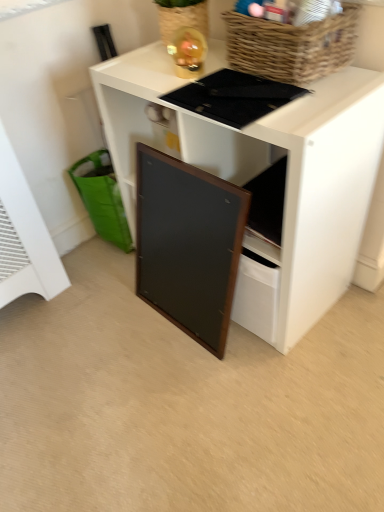
Question: Is woven brown basket at upper right wider than green fabric shopping basket at lower left?

Choices:
 (A) no
 (B) yes

Answer: (A)

Question: Is woven brown basket at upper right directly adjacent to green fabric shopping basket at lower left?

Choices:
 (A) no
 (B) yes

Answer: (A)

Question: Is woven brown basket at upper right smaller than green fabric shopping basket at lower left?

Choices:
 (A) no
 (B) yes

Answer: (B)

Question: From a real-world perspective, is woven brown basket at upper right positioned over green fabric shopping basket at lower left based on gravity?

Choices:
 (A) no
 (B) yes

Answer: (B)

Question: Could you tell me if woven brown basket at upper right is turned towards green fabric shopping basket at lower left?

Choices:
 (A) no
 (B) yes

Answer: (A)

Question: Looking at the image, does wooden framed board at center seem bigger or smaller compared to woven brown basket at upper right?

Choices:
 (A) big
 (B) small

Answer: (A)

Question: In terms of width, does wooden framed board at center look wider or thinner when compared to woven brown basket at upper right?

Choices:
 (A) wide
 (B) thin

Answer: (B)

Question: Considering the positions of point (223, 352) and point (349, 36), is point (223, 352) closer or farther from the camera than point (349, 36)?

Choices:
 (A) farther
 (B) closer

Answer: (A)

Question: Considering their positions, is wooden framed board at center located in front of or behind woven brown basket at upper right?

Choices:
 (A) front
 (B) behind

Answer: (B)

Question: Is woven brown basket at upper right inside or outside of wooden framed board at center?

Choices:
 (A) outside
 (B) inside

Answer: (A)

Question: Is woven brown basket at upper right to the left or to the right of wooden framed board at center in the image?

Choices:
 (A) left
 (B) right

Answer: (B)

Question: Is woven brown basket at upper right in front of or behind wooden framed board at center in the image?

Choices:
 (A) behind
 (B) front

Answer: (B)

Question: Is point (271, 78) closer or farther from the camera than point (160, 195)?

Choices:
 (A) closer
 (B) farther

Answer: (A)

Question: In terms of height, does green fabric shopping basket at lower left look taller or shorter compared to black matte board at center?

Choices:
 (A) short
 (B) tall

Answer: (A)

Question: Considering the relative positions of green fabric shopping basket at lower left and black matte board at center in the image provided, is green fabric shopping basket at lower left to the left or to the right of black matte board at center?

Choices:
 (A) right
 (B) left

Answer: (B)